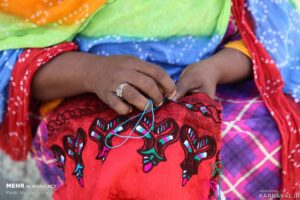
At what (x,y) coordinates should I click in order to perform the action: click on embroidery. Please return your answer as a coordinate pair (x, y). This screenshot has width=300, height=200. Looking at the image, I should click on (166, 119).